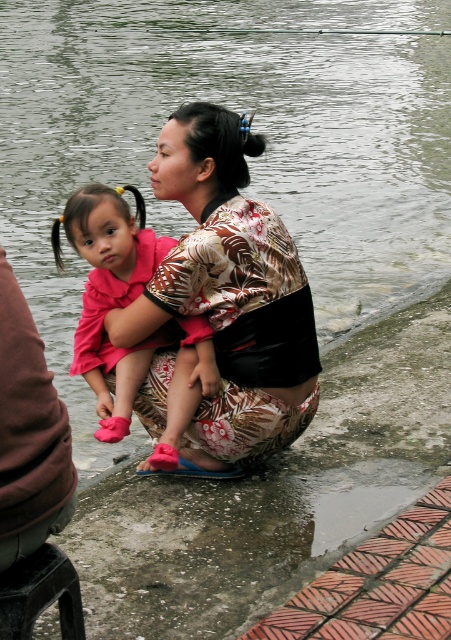
Does printed fabric kimono at center appear over brown fabric squat at lower left?

Indeed, printed fabric kimono at center is positioned over brown fabric squat at lower left.

The image size is (451, 640). Describe the element at coordinates (230, 291) in the screenshot. I see `printed fabric kimono at center` at that location.

Where is `printed fabric kimono at center`? Image resolution: width=451 pixels, height=640 pixels. printed fabric kimono at center is located at coordinates (230, 291).

Where is `printed fabric kimono at center`? Image resolution: width=451 pixels, height=640 pixels. printed fabric kimono at center is located at coordinates (230, 291).

You are a GUI agent. You are given a task and a screenshot of the screen. Output one action in this format:
    pyautogui.click(x=<x>, y=<y>)
    Task: Click on the printed fabric kimono at center
    
    Given the screenshot: What is the action you would take?
    pyautogui.click(x=230, y=291)

Between point (282, 275) and point (55, 570), which one is positioned in front?

Positioned in front is point (55, 570).

Identify the location of printed fabric kimono at center. This screenshot has width=451, height=640. (230, 291).

Measure the distance from pink fabric dress at center to wooden stool at lower left.

pink fabric dress at center is 1.45 meters away from wooden stool at lower left.

Who is higher up, pink fabric dress at center or wooden stool at lower left?

Positioned higher is pink fabric dress at center.

Which is behind, point (146, 250) or point (70, 570)?

Point (146, 250)

Image resolution: width=451 pixels, height=640 pixels. I want to click on pink fabric dress at center, so click(110, 292).